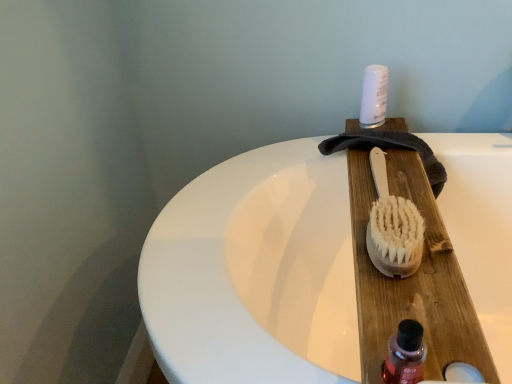
Question: Does white plastic canister at upper center have a greater width compared to natural wood brush at center?

Choices:
 (A) no
 (B) yes

Answer: (A)

Question: Is the surface of white plastic canister at upper center in direct contact with natural wood brush at center?

Choices:
 (A) no
 (B) yes

Answer: (A)

Question: Is white plastic canister at upper center shorter than natural wood brush at center?

Choices:
 (A) no
 (B) yes

Answer: (A)

Question: From a real-world perspective, is white plastic canister at upper center physically above natural wood brush at center?

Choices:
 (A) no
 (B) yes

Answer: (B)

Question: Could you tell me if white plastic canister at upper center is turned towards natural wood brush at center?

Choices:
 (A) no
 (B) yes

Answer: (B)

Question: Is white plastic canister at upper center taller than natural wood brush at center?

Choices:
 (A) no
 (B) yes

Answer: (B)

Question: Does natural wood brush at center come behind white plastic canister at upper center?

Choices:
 (A) no
 (B) yes

Answer: (A)

Question: Is natural wood brush at center wider than white plastic canister at upper center?

Choices:
 (A) no
 (B) yes

Answer: (B)

Question: Could you tell me if natural wood brush at center is facing white plastic canister at upper center?

Choices:
 (A) yes
 (B) no

Answer: (B)

Question: Is natural wood brush at center smaller than white plastic canister at upper center?

Choices:
 (A) no
 (B) yes

Answer: (A)

Question: From a real-world perspective, is natural wood brush at center physically below white plastic canister at upper center?

Choices:
 (A) yes
 (B) no

Answer: (A)

Question: Is natural wood brush at center at the right side of white plastic canister at upper center?

Choices:
 (A) no
 (B) yes

Answer: (A)

Question: From the image's perspective, does translucent plastic bottle at lower right appear lower than natural wood brush at center?

Choices:
 (A) no
 (B) yes

Answer: (B)